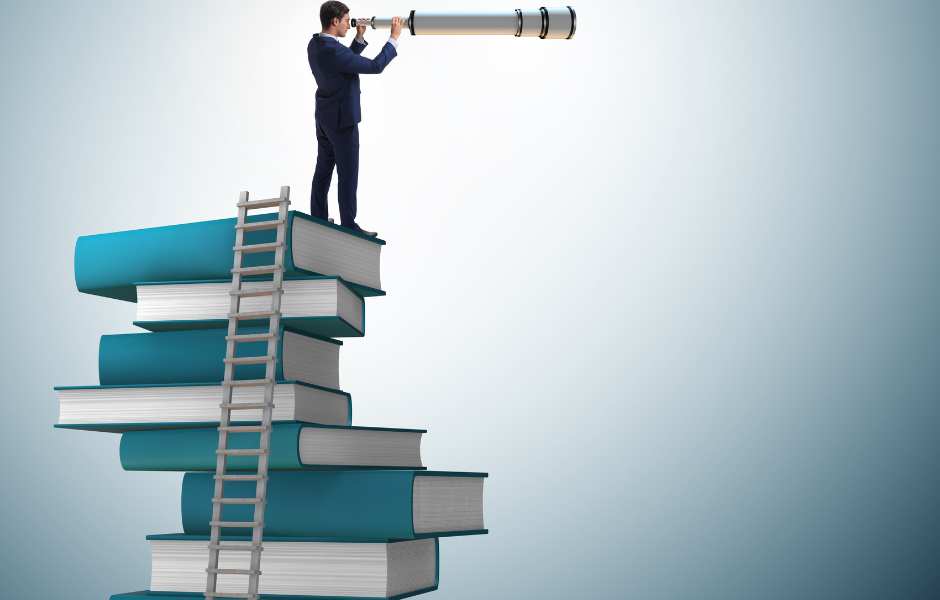
At what (x,y) coordinates should I click in order to perform the action: click on books. Please return your answer as a coordinate pair (x, y). The width and height of the screenshot is (940, 600). Looking at the image, I should click on (337, 513), (333, 571), (292, 439), (292, 395), (304, 352), (308, 304), (324, 249).